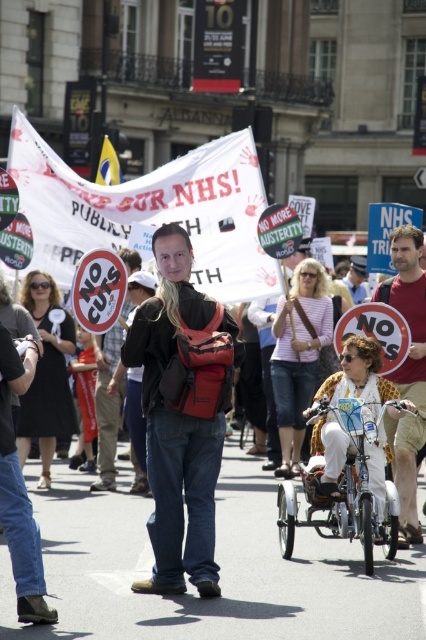
Okay, let me try to work through this problem step by step. First, I need to understand the user instructions thoroughly. The task is to generate a spatial reasoning question and answer based on the provided scene, objects, and their descriptions. Starting with the given information. The scene is a lively street protest with a central figure and a large banner. The objects here are two points specified by their coordinates, point A at (393,444) and point B at (359,259). The objects description,

Wait, the user provided the scene, objects, and objects description. The objects are two points with coordinates, and the description says that point A is closer to the viewer than point B. The rules state that the question must use the scene context, mention both objects exactly as given, and not reveal the objects description details. The answer should use the description to provide the correct response. First, I need to form a question that asks about the relative positions of these two points in

You are a photographer trying to capture both the white plastic tricycle at center and the matte red sign at center in a single shot. Based on their sizes, which object should you focus on first to ensure both are in frame?

The white plastic tricycle at center is not as tall as the matte red sign at center, so you should focus on the taller matte red sign at center first to ensure both are in frame.